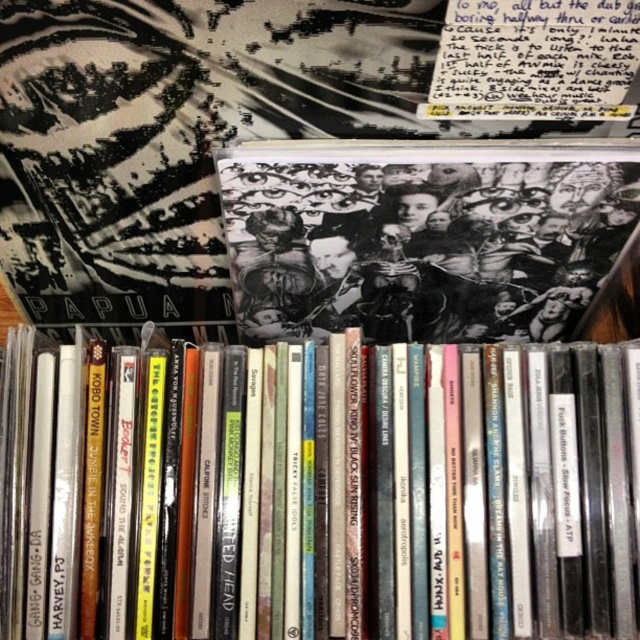
The height and width of the screenshot is (640, 640). Describe the element at coordinates (323, 490) in the screenshot. I see `matte black book at center` at that location.

Between matte black book at center and black matte book at center, which one appears on the right side from the viewer's perspective?

black matte book at center is more to the right.

The image size is (640, 640). What are the coordinates of `matte black book at center` in the screenshot? It's located at (323, 490).

Where is `matte black book at center`? Image resolution: width=640 pixels, height=640 pixels. matte black book at center is located at coordinates (323, 490).